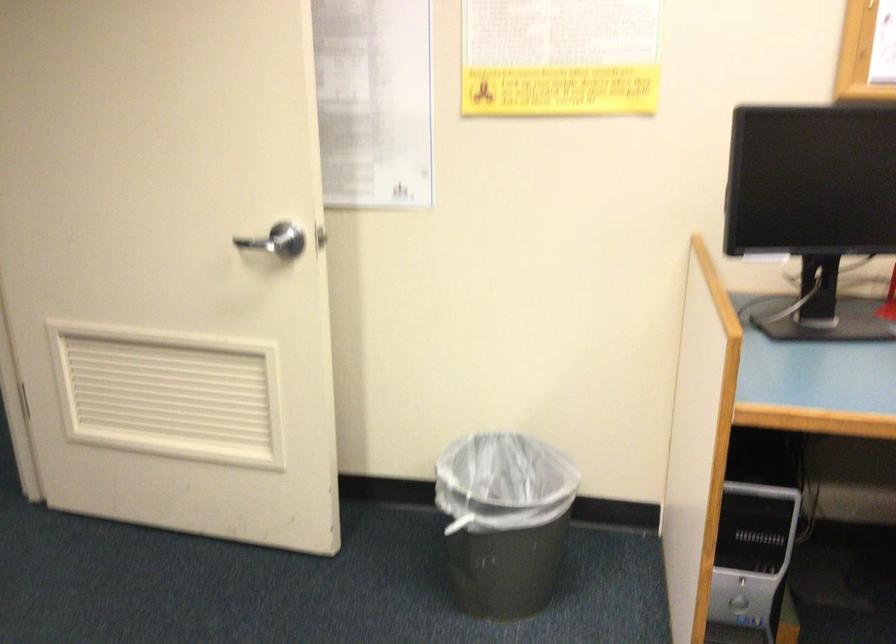
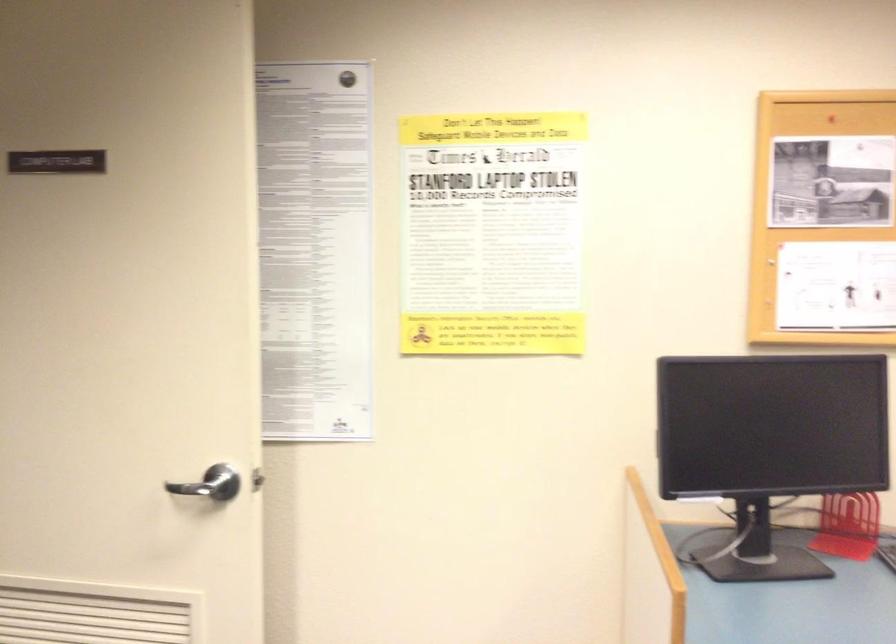
The images are taken continuously from a first-person perspective. In which direction are you moving?

The cameraman moved toward left, backward.